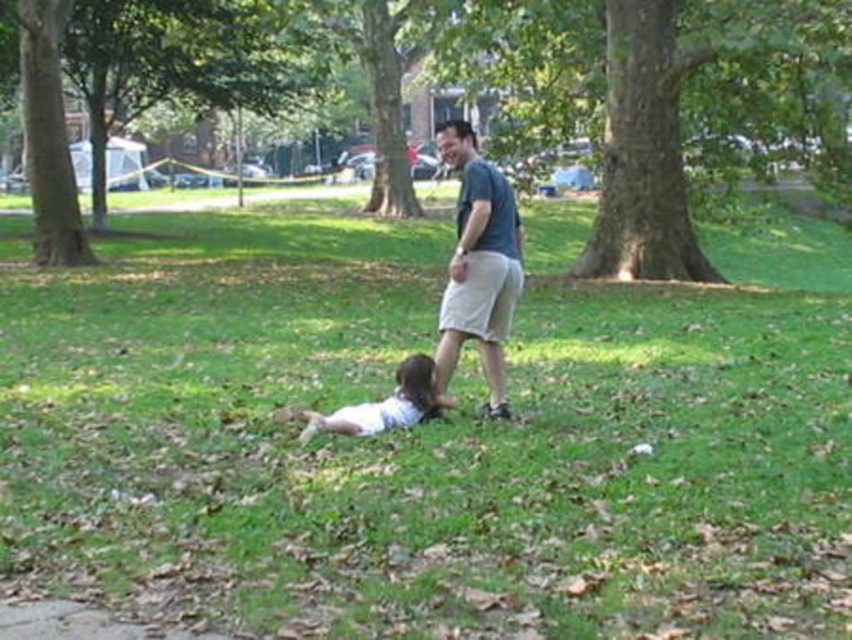
Who is shorter, green grassy at center or white matte shirt at lower center?

With less height is white matte shirt at lower center.

Is green grassy at center thinner than white matte shirt at lower center?

In fact, green grassy at center might be wider than white matte shirt at lower center.

What do you see at coordinates (426, 438) in the screenshot? The image size is (852, 640). I see `green grassy at center` at bounding box center [426, 438].

Locate an element on the screen. The image size is (852, 640). green grassy at center is located at coordinates (426, 438).

Is green leafy tree at center smaller than white matte shirt at lower center?

Actually, green leafy tree at center might be larger than white matte shirt at lower center.

Is point (521, 35) positioned in front of point (435, 397)?

No.

Find the location of a particular element. The height and width of the screenshot is (640, 852). green leafy tree at center is located at coordinates (655, 100).

Between point (243, 492) and point (205, 38), which one is positioned behind?

The point (205, 38) is more distant.

Who is more forward, (245,508) or (128,99)?

Point (245,508)

Where is `green grassy at center`? green grassy at center is located at coordinates (426, 438).